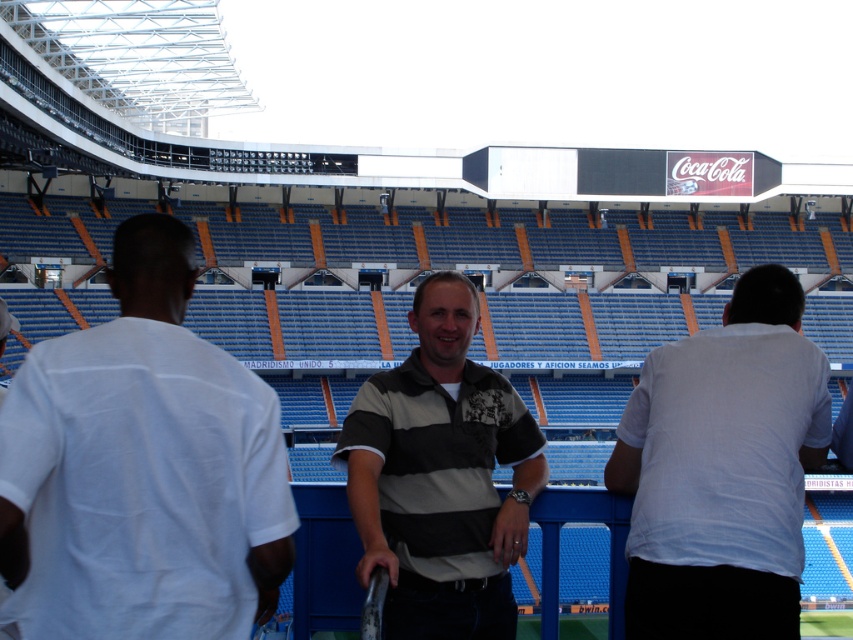
Question: Can you confirm if white cotton shirt at right is wider than striped cotton shirt at center?

Choices:
 (A) no
 (B) yes

Answer: (B)

Question: Which point is closer to the camera?

Choices:
 (A) (463, 310)
 (B) (775, 465)
 (C) (210, 634)

Answer: (C)

Question: Is the position of white cotton shirt at center less distant than that of striped cotton shirt at center?

Choices:
 (A) no
 (B) yes

Answer: (B)

Question: Which object is the closest to the striped cotton shirt at center?

Choices:
 (A) white cotton shirt at center
 (B) white cotton shirt at right

Answer: (B)

Question: Considering the relative positions of white cotton shirt at center and striped cotton shirt at center in the image provided, where is white cotton shirt at center located with respect to striped cotton shirt at center?

Choices:
 (A) below
 (B) above

Answer: (A)

Question: Considering the real-world distances, which object is closest to the white cotton shirt at center?

Choices:
 (A) striped cotton shirt at center
 (B) white cotton shirt at right

Answer: (A)